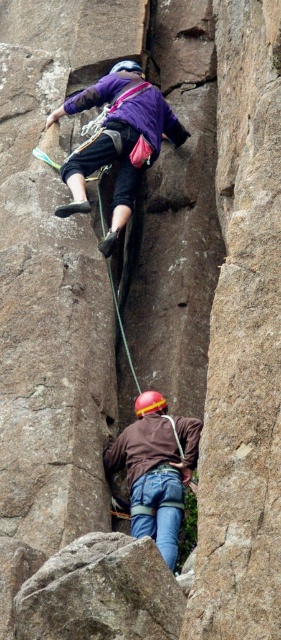
You are a climber preparing to ascend the rock. You see the rough textured rock at lower center and the matte purple shirt at upper center. Which object takes up more area in the image?

The matte purple shirt at upper center occupies more area in the image than the rough textured rock at lower center.

You are a drone operator trying to capture the climber wearing the matte purple shirt at upper center. The drone is currently at coordinates point A. To ensure safety, you need to position the drone at least 1 meter away from the climber. Given the climber is at point 0.220, 0.420, what coordinates should you set the drone to maintain the required distance?

The drone should be positioned at coordinates that are at least 1 meter away from the matte purple shirt at upper center located at point [118,140]. However, without knowing the scale of the coordinate system, it is impossible to determine the exact coordinates for the drone to maintain the 1 meter distance requirement.

You are a climber trying to reach a distant point while maintaining safety. The point you need to reach is located at point (125, 220). Given that the rope you have is 70 meters long, can you safely reach that point?

The distance between point (125, 220) and the camera is 80.39 meters. Since the rope is only 70 meters long, it is not long enough to safely reach that point.